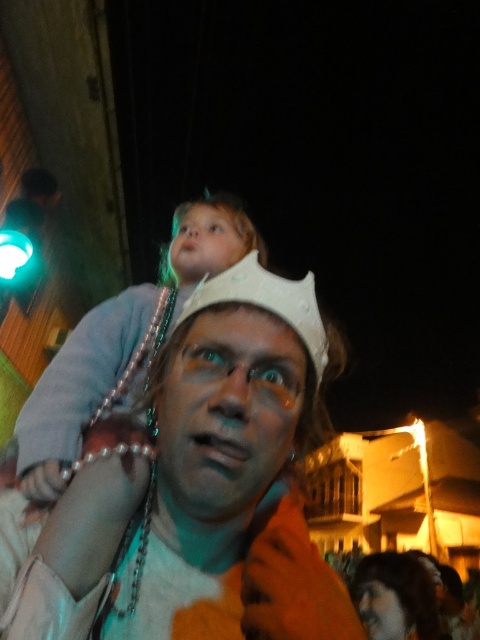
You are a photographer trying to capture the perfect shot of the scene. You notice a white pearl necklace at center located at point [191,490]. To ensure the necklace is in focus, you need to know its position relative to the two people. Is the white pearl necklace at center closer to the person wearing the white crown or the child on their shoulders?

The white pearl necklace at center is located at point [191,490]. Since the person with the white crown is in the foreground and the child is on their shoulders, the necklace is closer to the person wearing the white crown.

Based on the photo, you are organizing a costume party and need to ensure that the white matte crown at upper center and the smooth white crown at upper center are displayed properly. Which crown should be placed higher to make sure both are visible?

The smooth white crown at upper center should be placed higher since it is taller than the white matte crown at upper center, ensuring both are visible.